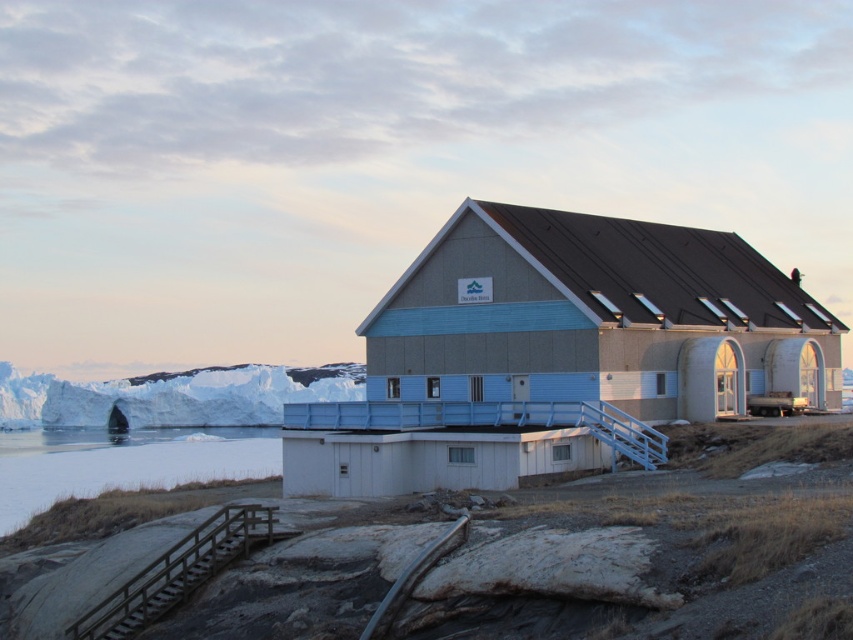
Looking at this image, you are standing in front of the modern building in the Arctic environment. You notice two points marked on the building facade. One is at point coordinates point (18,472) and the other is at point coordinates point (374,611). Which of these two points is closer to you?

Point (18,472) is further to the camera than point (374,611), so the point closer to you is point (374,611).

You are a delivery drone with a maximum flight range of 150 meters. You need to deliver a package from the wooden at lower left to the white ice at left. Can you complete the delivery without needing to recharge?

The distance between the white ice at left and the wooden at lower left is 142.37 meters, which is within your 150 meter range. Yes, you can complete the delivery without needing to recharge.

You are a visitor approaching the entrance of the modern building and notice the white ice at lower left and the metallic silver rail at lower center. Which object is closer to you as you approach the building?

The white ice at lower left is closer to you because it is further to the viewer than the metallic silver rail at lower center, meaning it appears nearer in your line of sight.